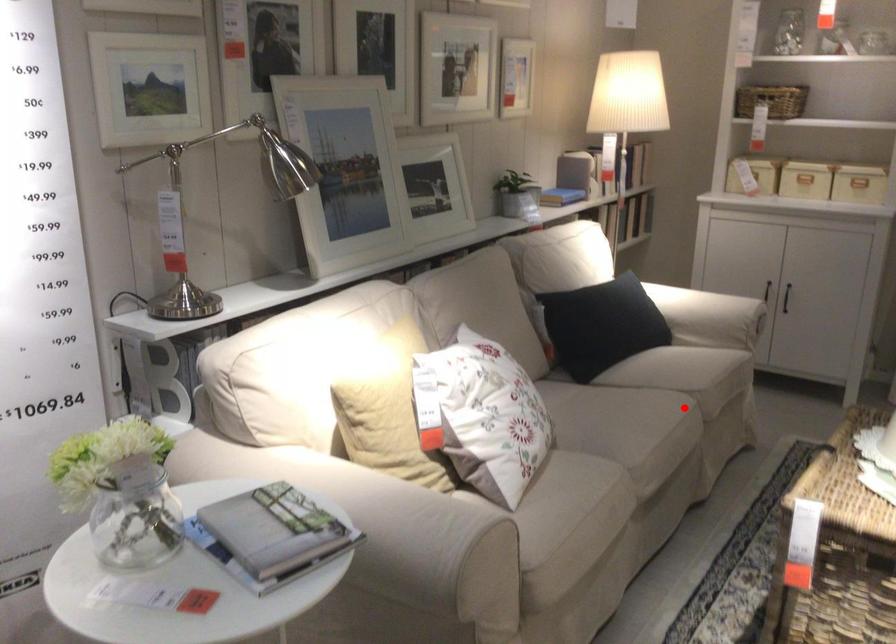
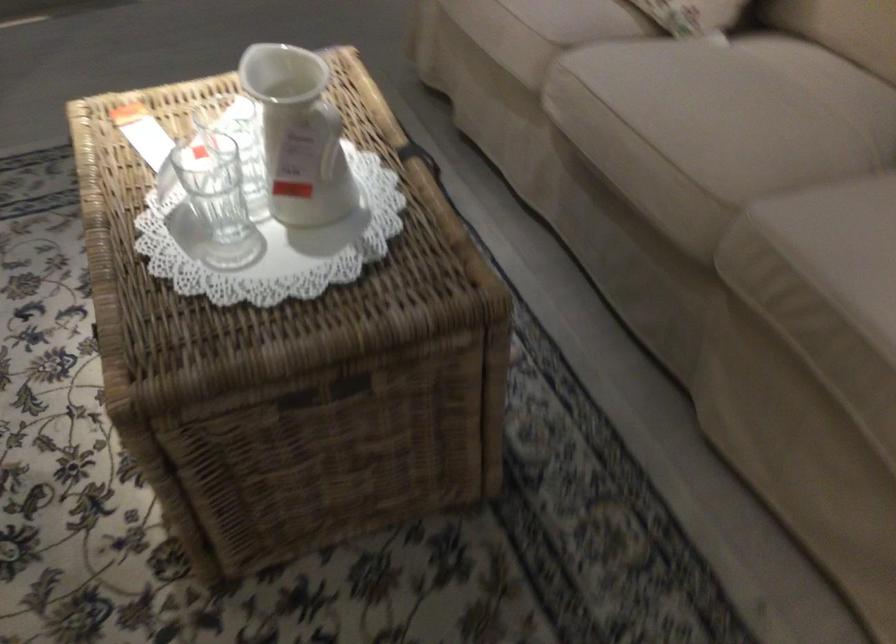
Question: I am providing you with two images of the same scene from different viewpoints. In image1, a red point is highlighted. Considering the same 3D point in image2, which of the following is correct?

Choices:
 (A) It is closer
 (B) It is farther

Answer: (A)